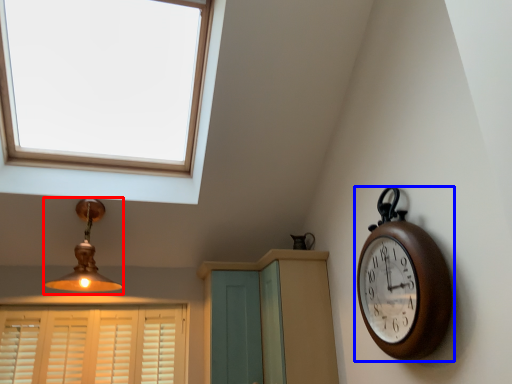
Question: Which object is further to the camera taking this photo, lamp (highlighted by a red box) or wall clock (highlighted by a blue box)?

Choices:
 (A) lamp
 (B) wall clock

Answer: (A)